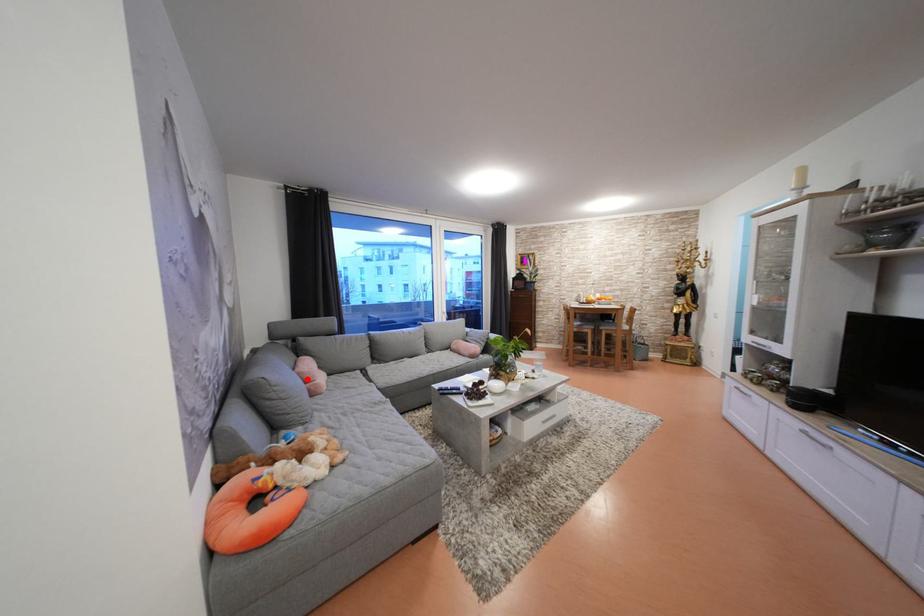
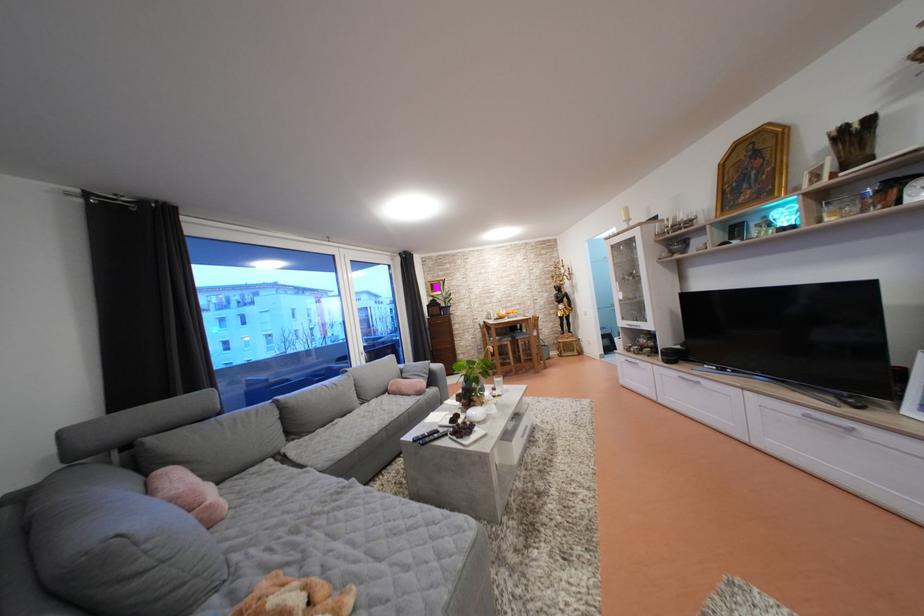
Question: I am providing you with two images of the same scene from different viewpoints. Given a red point in image1, look at the same physical point in image2. Is it:

Choices:
 (A) Closer to the viewpoint
 (B) Farther from the viewpoint

Answer: (B)